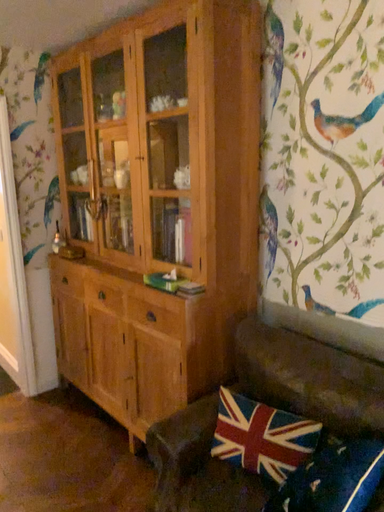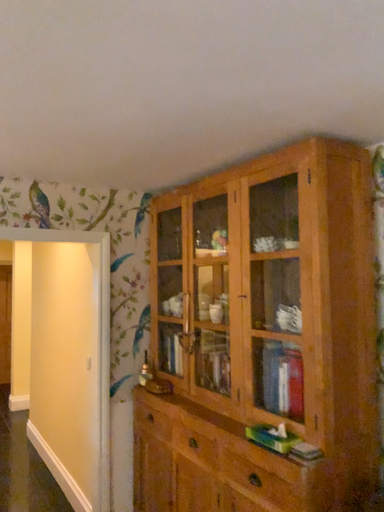
Question: How did the camera likely rotate when shooting the video?

Choices:
 (A) rotated left
 (B) rotated right

Answer: (A)